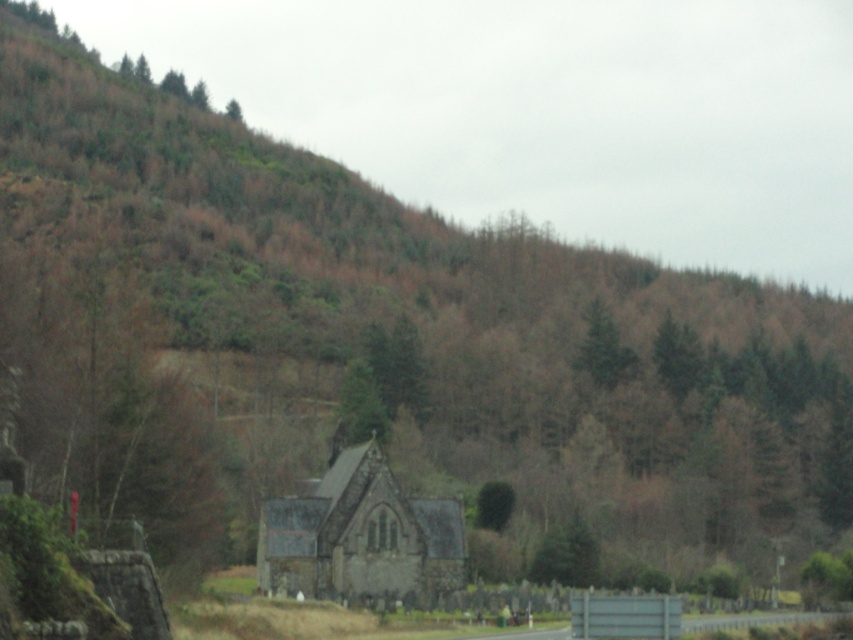
Between stone church at center and green textured tree at upper center, which one appears on the right side from the viewer's perspective?

From the viewer's perspective, green textured tree at upper center appears more on the right side.

The width and height of the screenshot is (853, 640). I want to click on stone church at center, so click(358, 536).

Is point (352, 538) farther from camera compared to point (595, 296)?

No, (352, 538) is in front of (595, 296).

Where is `stone church at center`? The height and width of the screenshot is (640, 853). stone church at center is located at coordinates (358, 536).